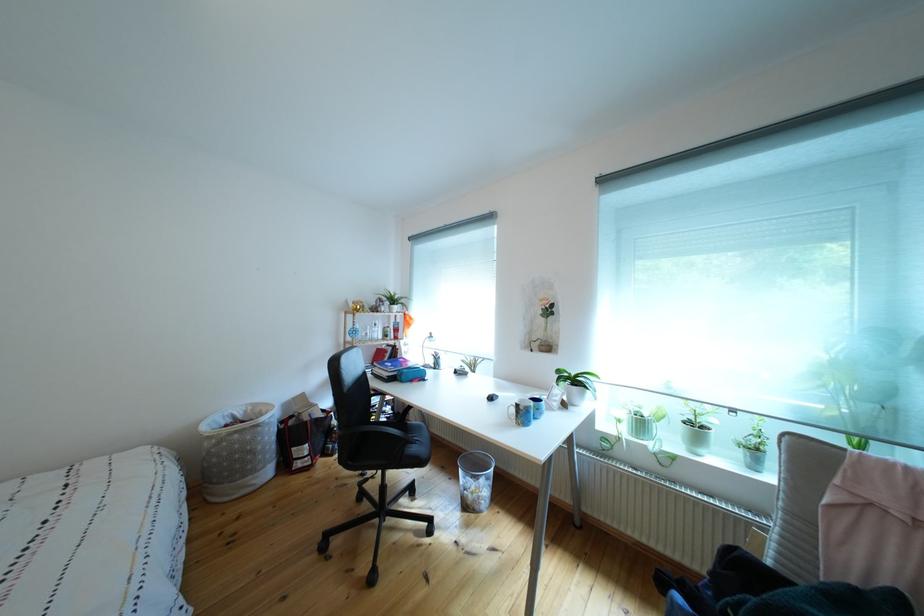
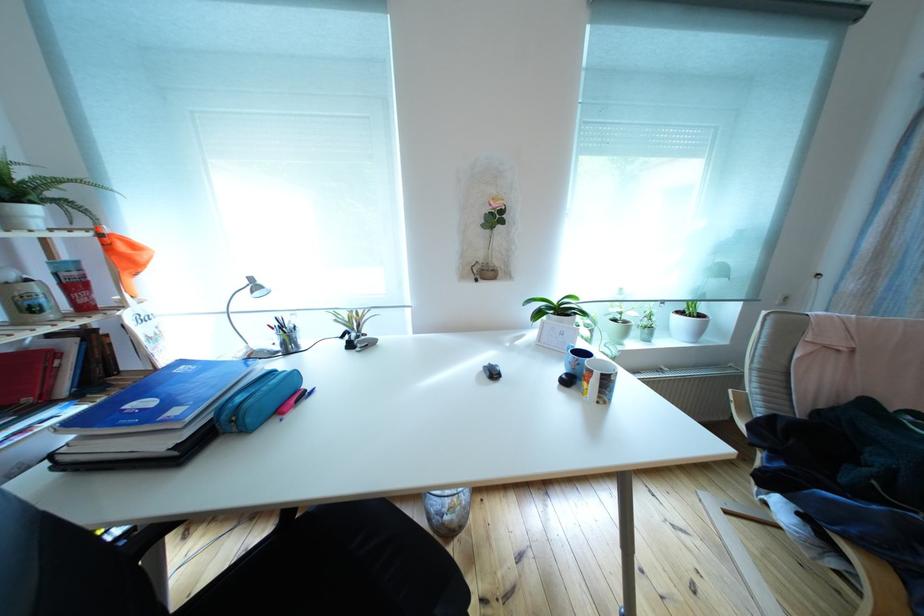
The point at (529,411) is marked in the first image. Where is the corresponding point in the second image?

(616, 383)